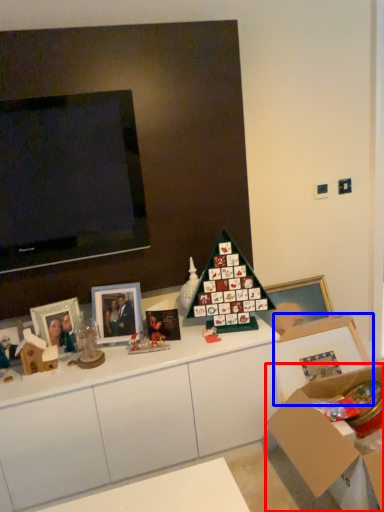
Question: Which point is further to the camera, cardboard box (highlighted by a red box) or picture frame (highlighted by a blue box)?

Choices:
 (A) cardboard box
 (B) picture frame

Answer: (B)